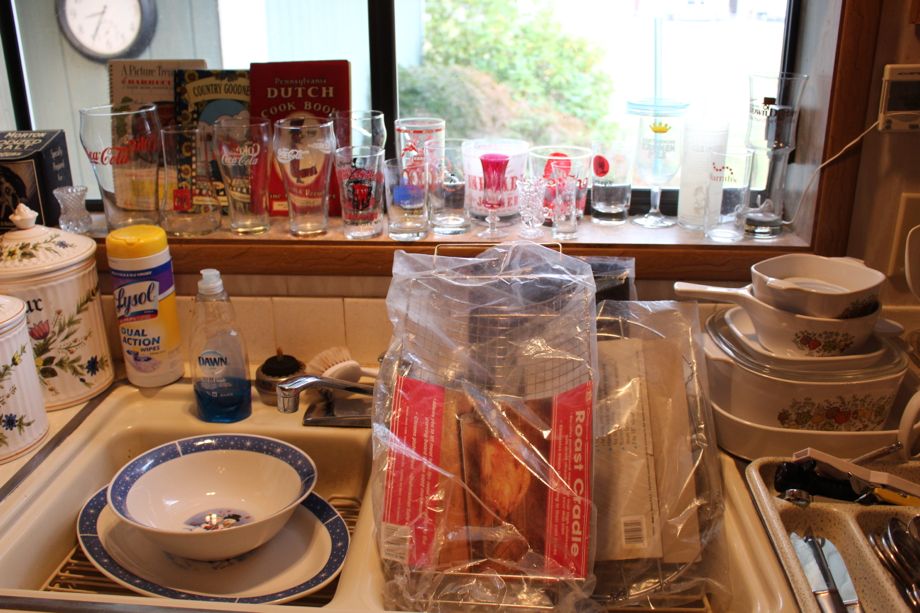
At what (x,y) coordinates should I click in order to perform the action: click on plate. Please return your answer as a coordinate pair (x, y). The width and height of the screenshot is (920, 613). Looking at the image, I should click on (295, 562).